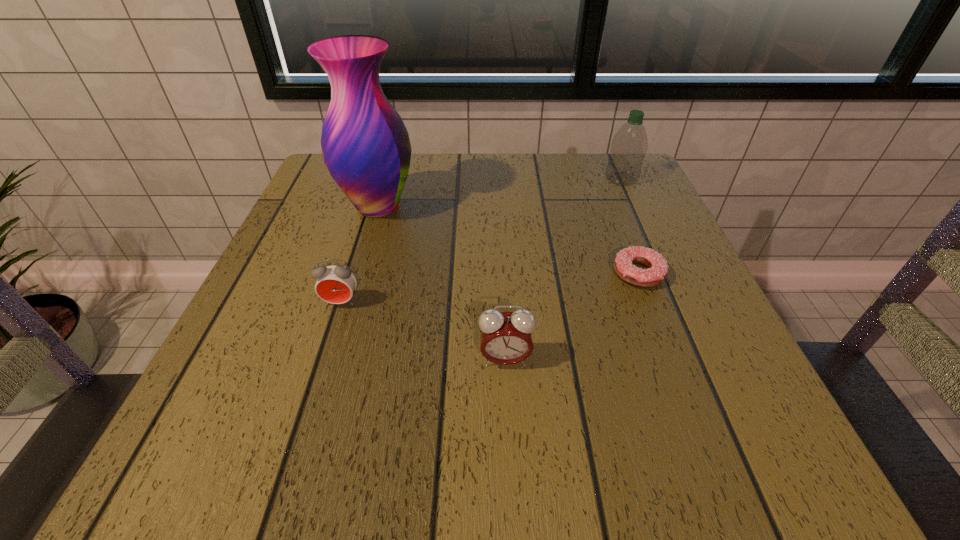
Where is `vase`? The height and width of the screenshot is (540, 960). vase is located at coordinates click(365, 145).

You are a GUI agent. You are given a task and a screenshot of the screen. Output one action in this format:
    pyautogui.click(x=<x>, y=<y>)
    Task: Click on the water bottle
    The width and height of the screenshot is (960, 540).
    Given the screenshot: What is the action you would take?
    pyautogui.click(x=629, y=146)

This screenshot has width=960, height=540. I want to click on the nearer alarm clock, so click(x=506, y=337).

Locate an element on the screen. the nearest object is located at coordinates (506, 337).

At what (x,y) coordinates should I click in order to perform the action: click on the fourth tallest object. Please return your answer as a coordinate pair (x, y). This screenshot has width=960, height=540. Looking at the image, I should click on (335, 284).

You are a GUI agent. You are given a task and a screenshot of the screen. Output one action in this format:
    pyautogui.click(x=<x>, y=<y>)
    Task: Click on the fourth farthest object
    
    Given the screenshot: What is the action you would take?
    pyautogui.click(x=335, y=284)

Locate an element on the screen. the shortest object is located at coordinates (623, 265).

Locate an element on the screen. This screenshot has height=540, width=960. doughnut is located at coordinates (623, 265).

Identify the location of vacant region located 0.080m on the back of the tallest object. (389, 168).

Locate an element on the screen. free point located on the back of the fourth shortest object is located at coordinates (612, 157).